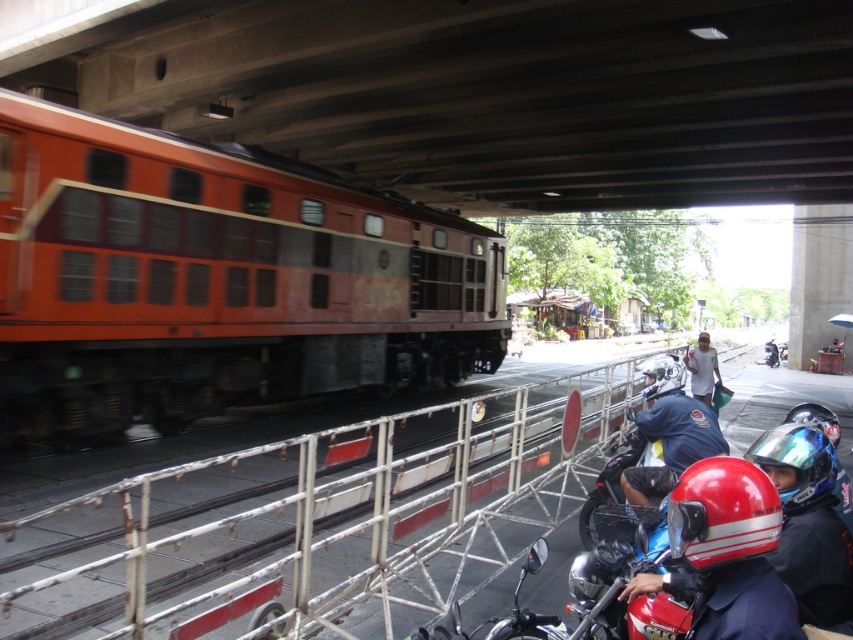
Does shiny red helmet at lower right appear on the right side of white matte shirt at right?

No, shiny red helmet at lower right is not to the right of white matte shirt at right.

Measure the distance between shiny red helmet at lower right and white matte shirt at right.

shiny red helmet at lower right is 7.68 meters from white matte shirt at right.

This screenshot has height=640, width=853. What are the coordinates of `shiny red helmet at lower right` in the screenshot? It's located at (724, 554).

Where is `shiny red helmet at lower right`? shiny red helmet at lower right is located at coordinates (724, 554).

Between orange matte train at left and shiny red helmet at lower right, which one has less height?

shiny red helmet at lower right

Between point (19, 93) and point (750, 582), which one is positioned in front?

Positioned in front is point (750, 582).

I want to click on orange matte train at left, so click(x=213, y=280).

Does shiny red helmet at lower right have a smaller size compared to red glossy motorcycle at lower right?

Correct, shiny red helmet at lower right occupies less space than red glossy motorcycle at lower right.

Who is more distant from viewer, (763, 561) or (517, 582)?

Positioned behind is point (517, 582).

Locate an element on the screen. shiny red helmet at lower right is located at coordinates (724, 554).